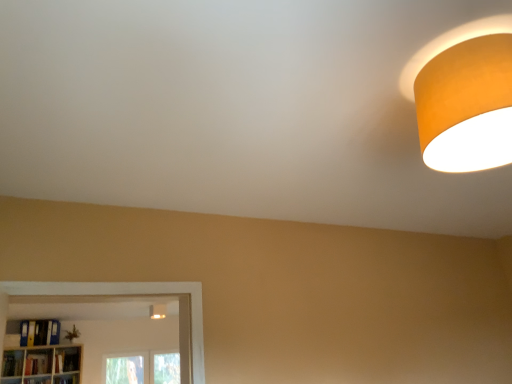
Question: Based on their sizes in the image, would you say hardcover book at lower left, which is the 3th book from right to left, is bigger or smaller than wooden bookshelf at lower left, arranged as the second shelf when viewed from the left?

Choices:
 (A) small
 (B) big

Answer: (B)

Question: In the image, is hardcover book at lower left, which is the 2th book in left-to-right order, positioned in front of or behind wooden bookshelf at lower left, positioned as the first shelf in right-to-left order?

Choices:
 (A) front
 (B) behind

Answer: (A)

Question: Estimate the real-world distances between objects in this image. Which object is closer to the wooden bookshelf at lower left, positioned as the first shelf in right-to-left order?

Choices:
 (A) hardcover book at lower left, the 1th book when ordered from left to right
 (B) matte white light fixture at lower center, marked as the first lamp in a left-to-right arrangement
 (C) hardcover book at lower left, positioned as the first book in right-to-left order
 (D) wooden bookshelf at lower left, the second shelf positioned from the right
 (E) hardcover book at lower left, which is the 2th book in left-to-right order

Answer: (C)

Question: Based on their relative distances, which object is nearer to the wooden bookshelf at lower left, the second shelf positioned from the right?

Choices:
 (A) wooden bookshelf at lower left, arranged as the second shelf when viewed from the left
 (B) hardcover book at lower left, which ranks as the 4th book in right-to-left order
 (C) orange matte lampshade at upper right, the 1th lamp in the front-to-back sequence
 (D) hardcover book at lower left, which ranks as the 4th book in left-to-right order
 (E) hardcover book at lower left, which is the 2th book in left-to-right order

Answer: (E)